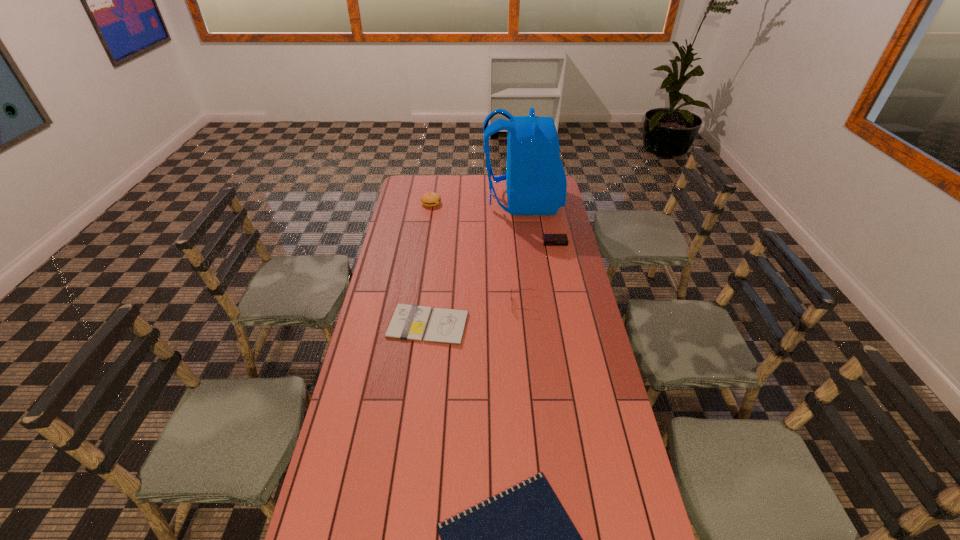
At what (x,y) coordinates should I click in order to perform the action: click on vacant space that's between the taller notepad and the spectacles. Please return your answer as a coordinate pair (x, y). Image resolution: width=960 pixels, height=540 pixels. Looking at the image, I should click on (476, 314).

This screenshot has width=960, height=540. What are the coordinates of `vacant region between the backpack and the farther notepad` in the screenshot? It's located at (475, 264).

Identify the location of free spot between the spectacles and the backpack. The image size is (960, 540). (522, 253).

This screenshot has height=540, width=960. In order to click on vacant space that's between the backpack and the third tallest object in this screenshot , I will do `click(522, 253)`.

Locate which object ranks fourth in proximity to the alarm clock. Please provide its 2D coordinates. Your answer should be formatted as a tuple, i.e. [(x, y)], where the tuple contains the x and y coordinates of a point satisfying the conditions above.

[(429, 199)]

Identify which object is the third nearest to the second shortest object. Please provide its 2D coordinates. Your answer should be formatted as a tuple, i.e. [(x, y)], where the tuple contains the x and y coordinates of a point satisfying the conditions above.

[(548, 239)]

At what (x,y) coordinates should I click in order to perform the action: click on free spot that satisfies the following two spatial constraints: 1. on the front face of the alarm clock; 2. on the temples of the spectacles. Please return your answer as a coordinate pair (x, y). Looking at the image, I should click on (568, 304).

Find the location of `vacant space that satisfies the following two spatial constraints: 1. on the front face of the fourth nearest object; 2. on the temples of the spectacles`. vacant space that satisfies the following two spatial constraints: 1. on the front face of the fourth nearest object; 2. on the temples of the spectacles is located at coordinates (568, 304).